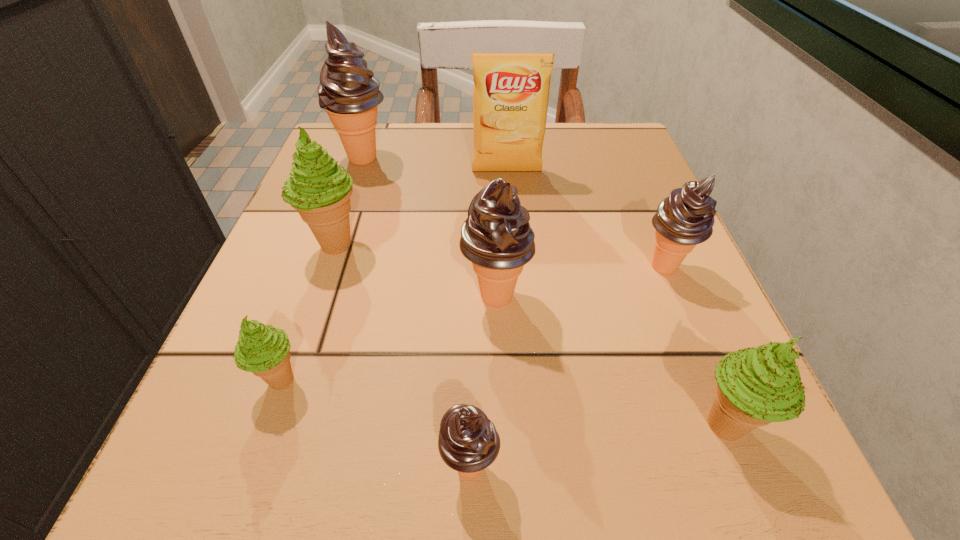
You are a GUI agent. You are given a task and a screenshot of the screen. Output one action in this format:
    pyautogui.click(x=<x>, y=<y>)
    Task: Click on the vacant space that's between the smallest green icecream and the rightmost chocolate icecream
    This screenshot has width=960, height=540.
    Given the screenshot: What is the action you would take?
    pyautogui.click(x=473, y=324)

Where is `free point between the smallest chocolate icecream and the crisp (potato chip)`? The width and height of the screenshot is (960, 540). free point between the smallest chocolate icecream and the crisp (potato chip) is located at coordinates (489, 319).

At what (x,y) coordinates should I click in order to perform the action: click on unoccupied position between the third smallest chocolate icecream and the smallest chocolate icecream. Please return your answer as a coordinate pair (x, y). This screenshot has width=960, height=540. Looking at the image, I should click on (483, 382).

You are a GUI agent. You are given a task and a screenshot of the screen. Output one action in this format:
    pyautogui.click(x=<x>, y=<y>)
    Task: Click on the free space between the third smallest chocolate icecream and the smallest chocolate icecream
    
    Given the screenshot: What is the action you would take?
    pyautogui.click(x=483, y=382)

In order to click on free spot between the crisp (potato chip) and the rightmost green icecream in this screenshot , I will do `click(615, 299)`.

The image size is (960, 540). What are the coordinates of `free space between the farthest icecream and the smallest green icecream` in the screenshot? It's located at (323, 269).

The width and height of the screenshot is (960, 540). Find the location of `object that can be found as the sixth closest to the crisp (potato chip)`. object that can be found as the sixth closest to the crisp (potato chip) is located at coordinates (755, 386).

Locate an element on the screen. Image resolution: width=960 pixels, height=540 pixels. object identified as the sixth closest to the farthest green icecream is located at coordinates (684, 219).

This screenshot has width=960, height=540. I want to click on icecream that stands as the fifth closest to the farthest green icecream, so click(x=684, y=219).

Identify the location of icecream that stands as the third closest to the third smallest chocolate icecream. The image size is (960, 540). (684, 219).